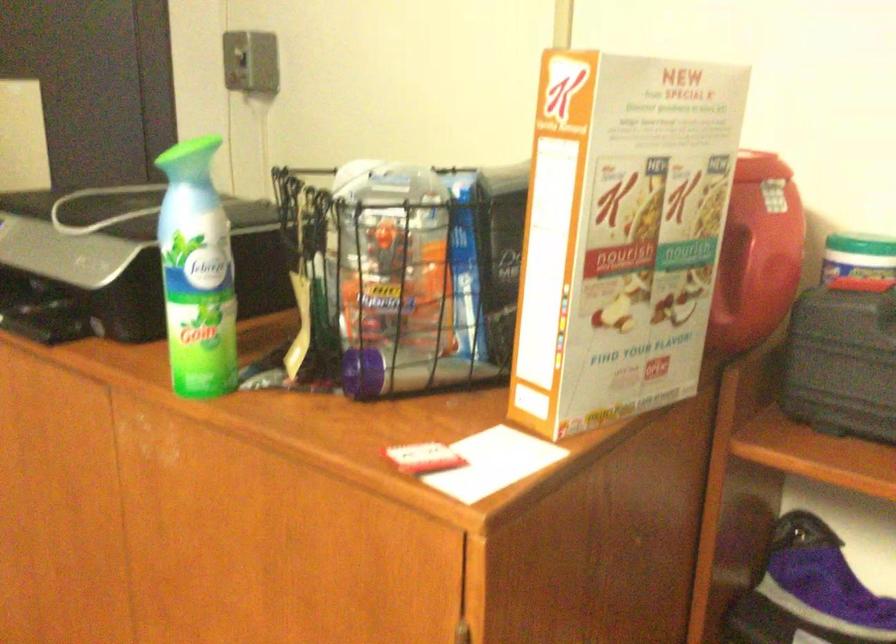
The height and width of the screenshot is (644, 896). Describe the element at coordinates (756, 252) in the screenshot. I see `a red container handle` at that location.